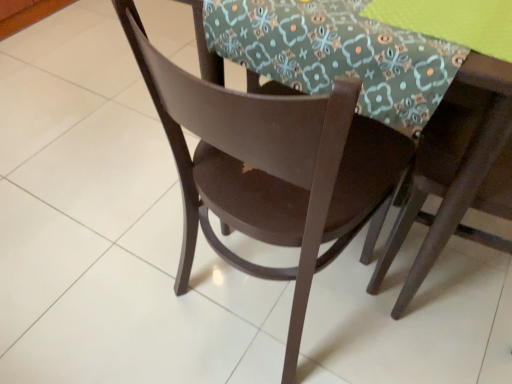
Find the location of a particular element. free spot to the left of matte brown table at center is located at coordinates tap(99, 201).